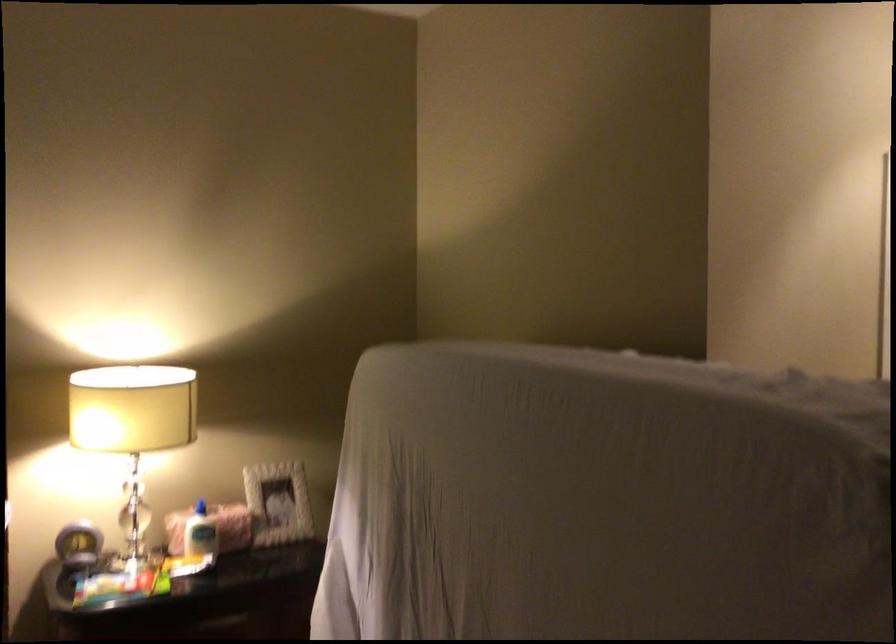
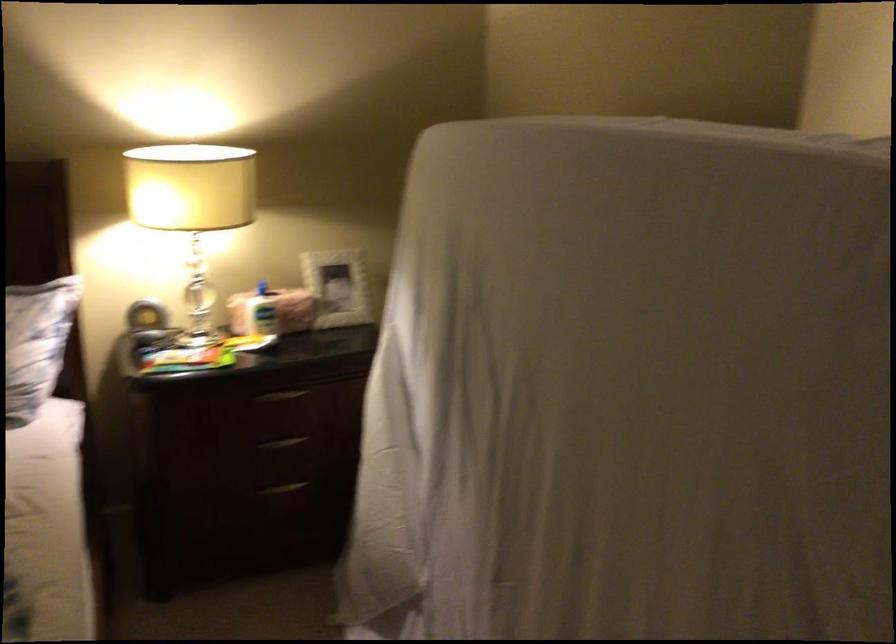
Find the pixel in the second image that matches the point at 211,529 in the first image.

(273, 310)